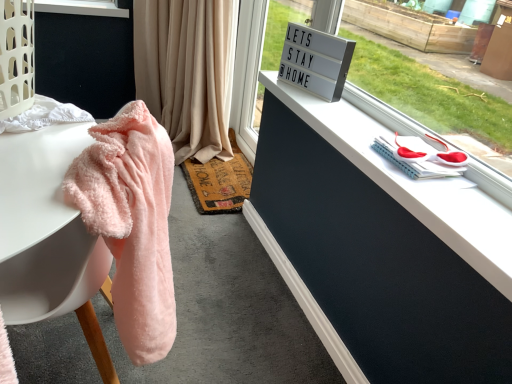
Locate an element on the screen. This screenshot has height=384, width=512. free space behind fluffy pink towel at left is located at coordinates (202, 307).